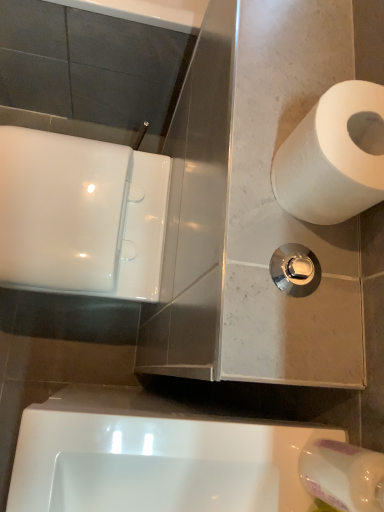
The image size is (384, 512). Identify the location of free space behind polished chrome flush handle at center-right. (305, 205).